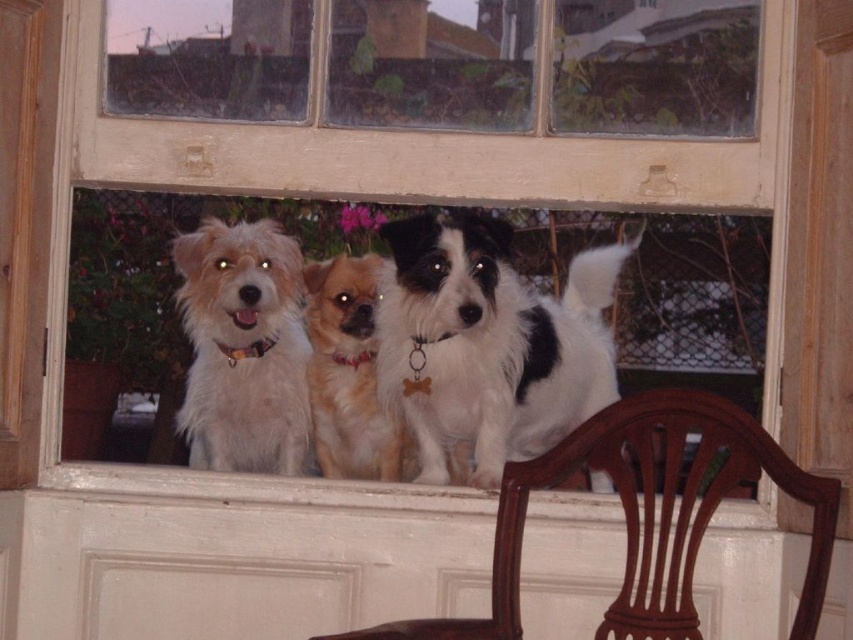
Which is more to the left, transparent glass window at center or golden brown fur at center?

golden brown fur at center

Is transparent glass window at center below golden brown fur at center?

No.

Does point (488, 189) lie in front of point (328, 426)?

Yes, it is in front of point (328, 426).

Find the location of a particular element. This screenshot has width=853, height=640. transparent glass window at center is located at coordinates (396, 186).

Is transparent glass window at center to the left of white fluffy dog at center from the viewer's perspective?

In fact, transparent glass window at center is to the right of white fluffy dog at center.

Can you confirm if transparent glass window at center is wider than white fluffy dog at center?

Indeed, transparent glass window at center has a greater width compared to white fluffy dog at center.

Where is `transparent glass window at center`? This screenshot has height=640, width=853. transparent glass window at center is located at coordinates (396, 186).

What do you see at coordinates (489, 342) in the screenshot? Image resolution: width=853 pixels, height=640 pixels. I see `black and white fur at center` at bounding box center [489, 342].

Is black and white fur at center positioned before golden brown fur at center?

That is True.

The height and width of the screenshot is (640, 853). I want to click on black and white fur at center, so click(489, 342).